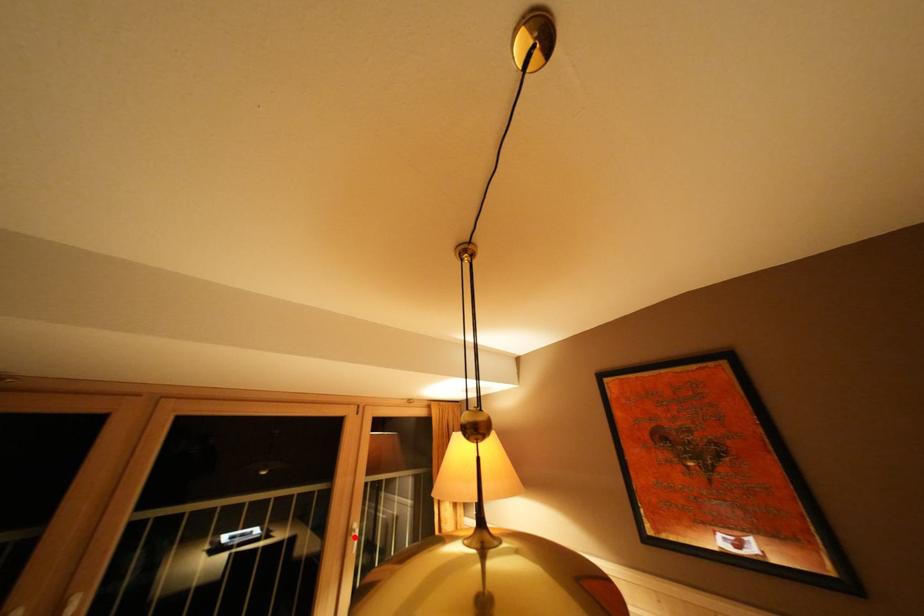
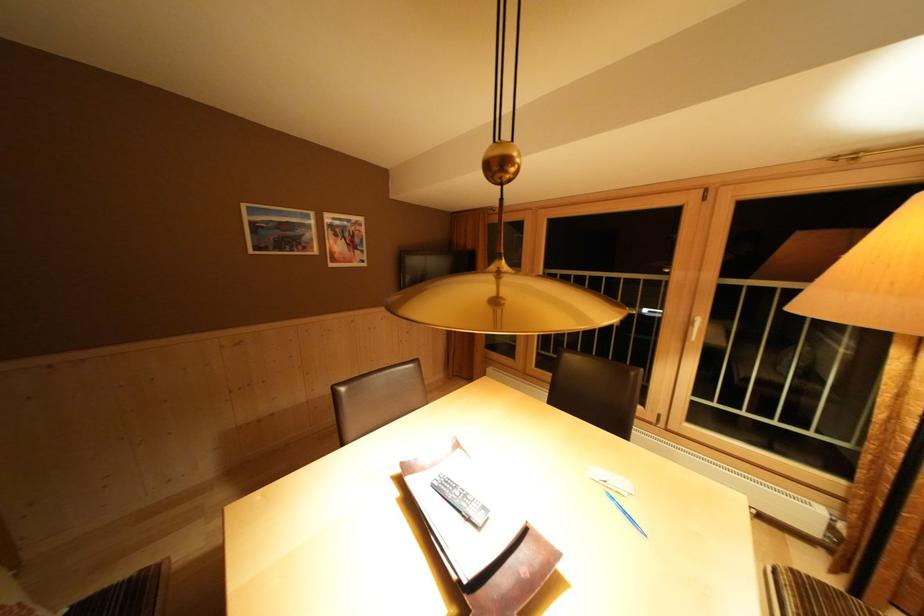
The point at the highlighted location is marked in the first image. Where is the corresponding point in the second image?

(697, 328)